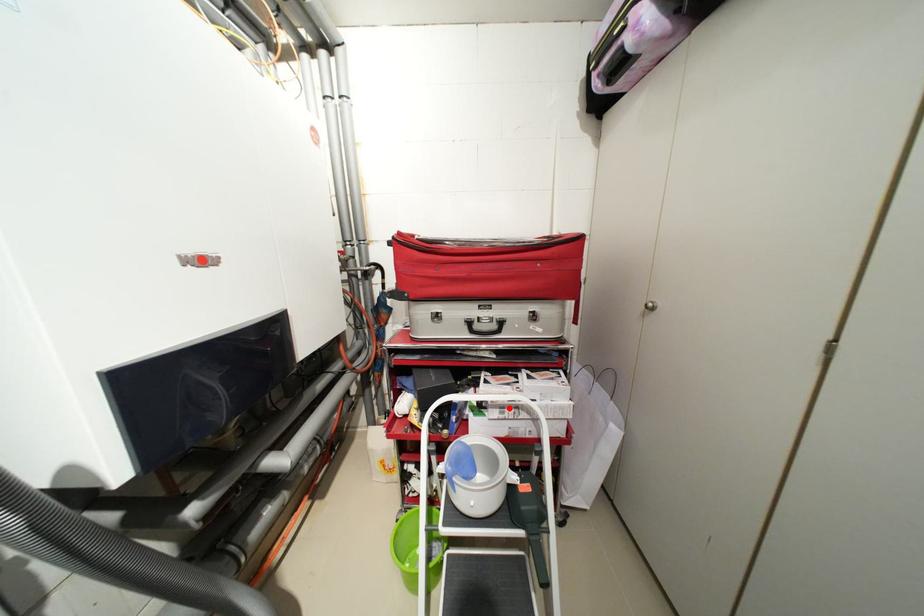
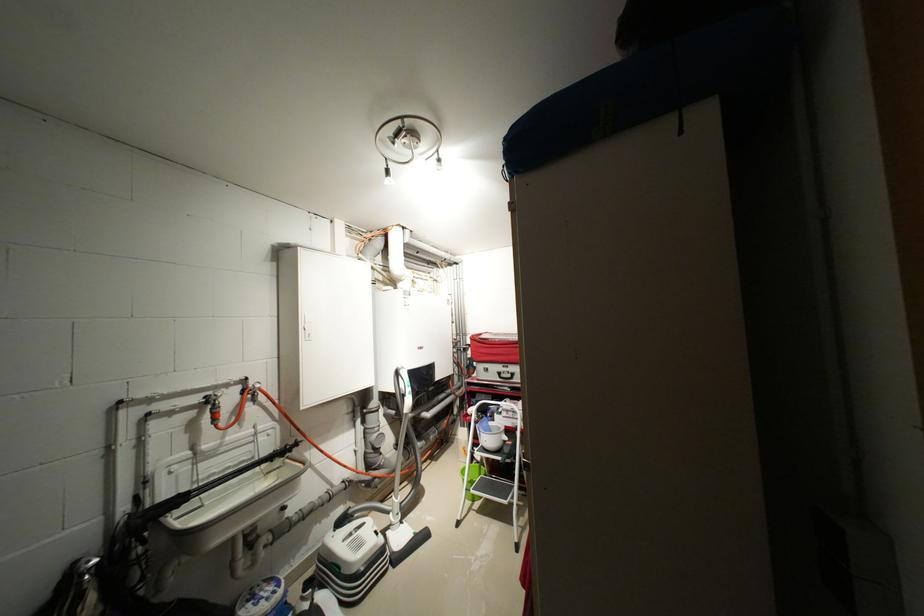
The point at the highlighted location is marked in the first image. Where is the corresponding point in the second image?

(515, 411)